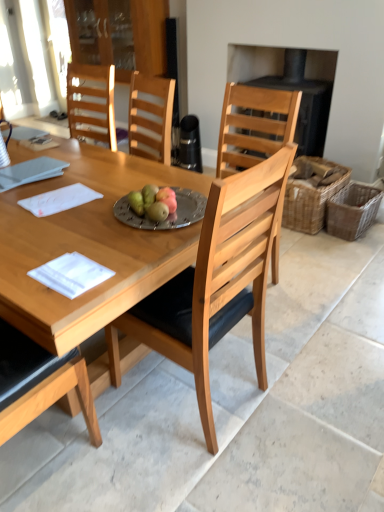
What do you see at coordinates (71, 274) in the screenshot? This screenshot has height=512, width=384. I see `white paper at center, the 1th notepad when ordered from bottom to top` at bounding box center [71, 274].

What are the coordinates of `wooden table at center` in the screenshot? It's located at (87, 244).

Describe the element at coordinates (310, 200) in the screenshot. I see `woven brown picnic basket at right, which ranks as the first picnic basket in left-to-right order` at that location.

Locate an element on the screen. woven brown picnic basket at right, which is the second picnic basket in left-to-right order is located at coordinates (352, 210).

Considering the sizes of objects light wood chair at center and white paper at left, positioned as the first notepad in top-to-bottom order, in the image provided, who is shorter, light wood chair at center or white paper at left, positioned as the first notepad in top-to-bottom order,?

With less height is white paper at left, positioned as the first notepad in top-to-bottom order.

Considering the relative sizes of light wood chair at center and white paper at left, positioned as the first notepad in top-to-bottom order, in the image provided, is light wood chair at center wider than white paper at left, positioned as the first notepad in top-to-bottom order,?

Correct, the width of light wood chair at center exceeds that of white paper at left, positioned as the first notepad in top-to-bottom order.

Is light wood chair at center beside white paper at left, positioned as the first notepad in back-to-front order?

No, light wood chair at center is not beside white paper at left, positioned as the first notepad in back-to-front order.

Consider the image. Is white paper at left, positioned as the third notepad in front-to-back order, next to silver metallic plate at center and touching it?

white paper at left, positioned as the third notepad in front-to-back order, and silver metallic plate at center are not in contact.

Can you confirm if white paper at left, positioned as the first notepad in back-to-front order, is shorter than silver metallic plate at center?

Incorrect, the height of white paper at left, positioned as the first notepad in back-to-front order, does not fall short of that of silver metallic plate at center.

Based on their positions, is white paper at left, positioned as the first notepad in back-to-front order, located to the left or right of silver metallic plate at center?

white paper at left, positioned as the first notepad in back-to-front order, is positioned on silver metallic plate at center's left side.

Could you tell me if black matte fireplace at upper right is turned towards silver metallic plate at center?

Yes, black matte fireplace at upper right is facing silver metallic plate at center.

I want to click on fireplace located behind the silver metallic plate at center, so click(x=299, y=89).

Who is shorter, black matte fireplace at upper right or silver metallic plate at center?

Standing shorter between the two is silver metallic plate at center.

From the image's perspective, would you say black matte fireplace at upper right is shown under silver metallic plate at center?

No, from the image's perspective, black matte fireplace at upper right is not below silver metallic plate at center.

Looking at their sizes, would you say silver metallic plate at center is wider or thinner than woven brown picnic basket at right, which ranks as the first picnic basket in left-to-right order?

Considering their sizes, silver metallic plate at center looks slimmer than woven brown picnic basket at right, which ranks as the first picnic basket in left-to-right order.

Relative to woven brown picnic basket at right, which ranks as the first picnic basket in left-to-right order, is silver metallic plate at center in front or behind?

In the image, silver metallic plate at center appears in front of woven brown picnic basket at right, which ranks as the first picnic basket in left-to-right order.

Is there a large distance between silver metallic plate at center and woven brown picnic basket at right, which ranks as the first picnic basket in left-to-right order?

Yes.

How much distance is there between silver metallic plate at center and woven brown picnic basket at right, positioned as the 2th picnic basket in right-to-left order?

They are 4.89 feet apart.

From the image's perspective, is white paper at left, positioned as the first notepad in top-to-bottom order, under woven brown picnic basket at right, the first picnic basket in the right-to-left sequence?

No, from the image's perspective, white paper at left, positioned as the first notepad in top-to-bottom order, is not beneath woven brown picnic basket at right, the first picnic basket in the right-to-left sequence.

Looking at this image, between white paper at left, positioned as the first notepad in back-to-front order, and woven brown picnic basket at right, which is the second picnic basket in left-to-right order, which one has larger width?

With larger width is woven brown picnic basket at right, which is the second picnic basket in left-to-right order.

Is white paper at left, positioned as the third notepad in front-to-back order, completely or partially outside of woven brown picnic basket at right, the first picnic basket in the right-to-left sequence?

That's correct, white paper at left, positioned as the third notepad in front-to-back order, is outside of woven brown picnic basket at right, the first picnic basket in the right-to-left sequence.

Considering the sizes of white paper at left, the 3th notepad in the bottom-to-top sequence, and woven brown picnic basket at right, which is the second picnic basket in left-to-right order, in the image, is white paper at left, the 3th notepad in the bottom-to-top sequence, bigger or smaller than woven brown picnic basket at right, which is the second picnic basket in left-to-right order,?

Considering their sizes, white paper at left, the 3th notepad in the bottom-to-top sequence, takes up less space than woven brown picnic basket at right, which is the second picnic basket in left-to-right order.

In terms of size, does white paper at center, which is counted as the 1th notepad, starting from the front, appear bigger or smaller than silver metallic plate at center?

white paper at center, which is counted as the 1th notepad, starting from the front, is smaller than silver metallic plate at center.

From a real-world perspective, which object rests below the other?

white paper at center, which is counted as the 1th notepad, starting from the front, is physically lower.

Considering the positions of objects white paper at center, the 2th notepad from the front, and white paper at left, positioned as the third notepad in front-to-back order, in the image provided, who is more to the left, white paper at center, the 2th notepad from the front, or white paper at left, positioned as the third notepad in front-to-back order,?

Positioned to the left is white paper at left, positioned as the third notepad in front-to-back order.

From the image's perspective, which is above, white paper at center, which ranks as the second notepad in bottom-to-top order, or white paper at left, positioned as the first notepad in top-to-bottom order?

white paper at left, positioned as the first notepad in top-to-bottom order, is shown above in the image.

Is white paper at center, which is the 2th notepad from top to bottom, further to camera compared to white paper at left, positioned as the third notepad in front-to-back order?

That is False.

Where is `the 3rd notepad above the light wood chair at center (from the image's perspective)`? This screenshot has height=512, width=384. the 3rd notepad above the light wood chair at center (from the image's perspective) is located at coordinates (30, 172).

This screenshot has width=384, height=512. Identify the location of plate lying below the white paper at left, positioned as the third notepad in front-to-back order (from the image's perspective). (168, 215).

Looking at the image, which one is located closer to white paper at center, the 3th notepad when ordered from back to front, woven brown picnic basket at right, the first picnic basket in the right-to-left sequence, or woven brown picnic basket at right, which ranks as the first picnic basket in left-to-right order?

woven brown picnic basket at right, which ranks as the first picnic basket in left-to-right order, lies closer to white paper at center, the 3th notepad when ordered from back to front, than the other object.

Based on their spatial positions, is woven brown picnic basket at right, which ranks as the first picnic basket in left-to-right order, or transparent glass cabinet at upper center closer to white paper at center, which is counted as the 1th notepad, starting from the front?

The object closer to white paper at center, which is counted as the 1th notepad, starting from the front, is woven brown picnic basket at right, which ranks as the first picnic basket in left-to-right order.

Estimate the real-world distances between objects in this image. Which object is further from white paper at center, the second notepad when ordered from back to front, woven brown picnic basket at right, which ranks as the first picnic basket in left-to-right order, or silver metallic plate at center?

woven brown picnic basket at right, which ranks as the first picnic basket in left-to-right order, lies further to white paper at center, the second notepad when ordered from back to front, than the other object.

Estimate the real-world distances between objects in this image. Which object is further from wooden table at center, light wood chair at center or white paper at center, the 2th notepad from the front?

The object further to wooden table at center is light wood chair at center.

Considering their positions, is white paper at center, the 3th notepad when ordered from back to front, positioned further to wooden table at center than light wood chair at center?

light wood chair at center lies further to wooden table at center than the other object.

From the image, which object appears to be nearer to silver metallic plate at center, wooden table at center or white paper at left, positioned as the first notepad in back-to-front order?

Among the two, wooden table at center is located nearer to silver metallic plate at center.

When comparing their distances from wooden table at center, does white paper at left, positioned as the first notepad in back-to-front order, or silver metallic plate at center seem further?

Among the two, white paper at left, positioned as the first notepad in back-to-front order, is located further to wooden table at center.

Which object lies nearer to the anchor point transparent glass cabinet at upper center, white paper at center, which is the 2th notepad from top to bottom, or woven brown picnic basket at right, which is the second picnic basket in left-to-right order?

Among the two, woven brown picnic basket at right, which is the second picnic basket in left-to-right order, is located nearer to transparent glass cabinet at upper center.

I want to click on notepad between white paper at center, the 1th notepad when ordered from bottom to top, and white paper at left, positioned as the third notepad in front-to-back order, in the front-back direction, so click(59, 200).

This screenshot has height=512, width=384. I want to click on plate located between white paper at left, positioned as the first notepad in back-to-front order, and woven brown picnic basket at right, which ranks as the first picnic basket in left-to-right order, in the left-right direction, so click(168, 215).

Where is `picnic basket between transparent glass cabinet at upper center and white paper at left, positioned as the third notepad in front-to-back order, in the up-down direction`? Image resolution: width=384 pixels, height=512 pixels. picnic basket between transparent glass cabinet at upper center and white paper at left, positioned as the third notepad in front-to-back order, in the up-down direction is located at coordinates (310, 200).

Where is `fireplace located between silver metallic plate at center and transparent glass cabinet at upper center in the depth direction`? The image size is (384, 512). fireplace located between silver metallic plate at center and transparent glass cabinet at upper center in the depth direction is located at coordinates (299, 89).